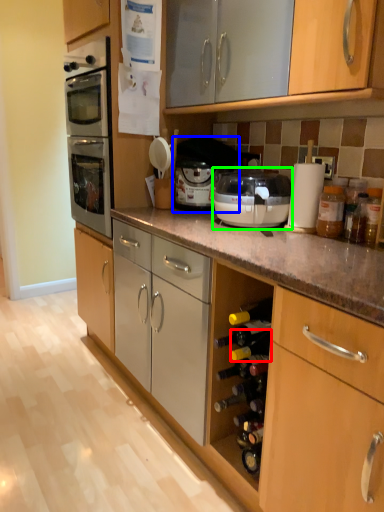
Question: Which object is the farthest from wine bottle (highlighted by a red box)? Choose among these: appliance (highlighted by a blue box) or kitchen appliance (highlighted by a green box).

Choices:
 (A) appliance
 (B) kitchen appliance

Answer: (A)